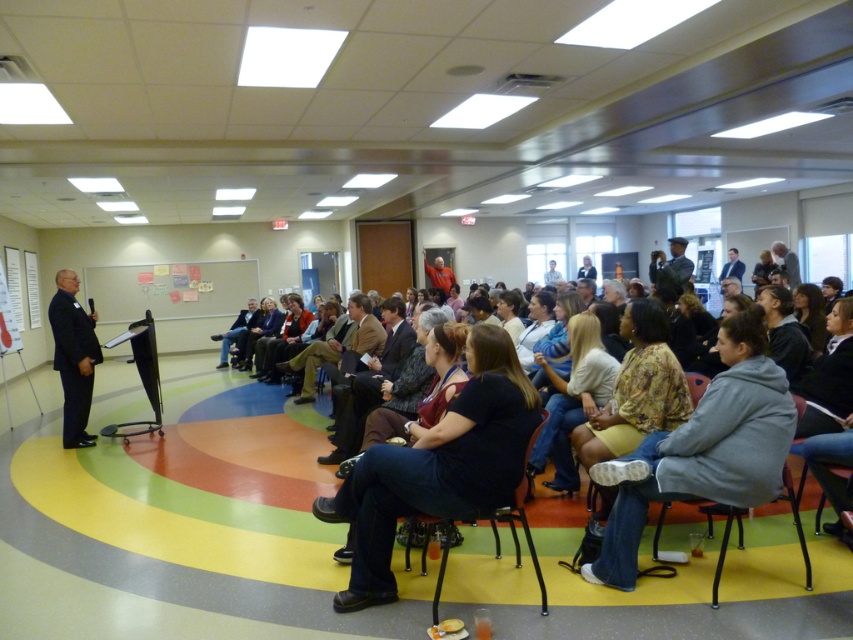
Between point (541, 612) and point (676, 282), which one is positioned behind?

Point (676, 282)

Can you confirm if black plastic chair at center is positioned to the left of dark gray uniform at center?

Correct, you'll find black plastic chair at center to the left of dark gray uniform at center.

Is point (519, 513) farther from viewer compared to point (688, 260)?

No.

The width and height of the screenshot is (853, 640). In order to click on black plastic chair at center in this screenshot , I will do `click(519, 518)`.

Is floral fabric blouse at center shorter than black plastic chair at center?

Incorrect, floral fabric blouse at center's height does not fall short of black plastic chair at center's.

This screenshot has height=640, width=853. What are the coordinates of `floral fabric blouse at center` in the screenshot? It's located at (703, 449).

This screenshot has width=853, height=640. Find the location of `floral fabric blouse at center`. floral fabric blouse at center is located at coordinates 703,449.

Find the location of a particular element. The image size is (853, 640). gray fabric jacket at upper right is located at coordinates (786, 262).

Describe the element at coordinates (786, 262) in the screenshot. I see `gray fabric jacket at upper right` at that location.

The width and height of the screenshot is (853, 640). In order to click on gray fabric jacket at upper right in this screenshot , I will do `click(786, 262)`.

You are a GUI agent. You are given a task and a screenshot of the screen. Output one action in this format:
    pyautogui.click(x=<x>, y=<y>)
    Task: Click on the gray fabric jacket at upper right
    This screenshot has height=640, width=853.
    Given the screenshot: What is the action you would take?
    pyautogui.click(x=786, y=262)